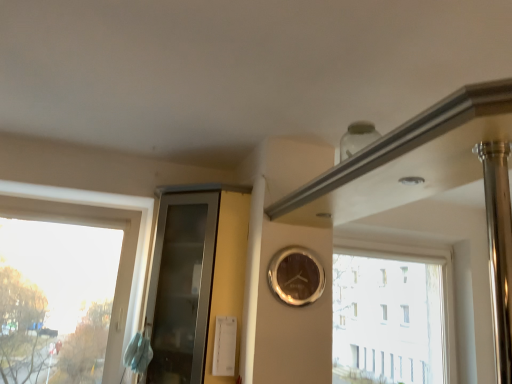
Question: In terms of size, does transparent glass window at upper right, the 1th window in the back-to-front sequence, appear bigger or smaller than shiny gold clock at center?

Choices:
 (A) small
 (B) big

Answer: (B)

Question: Is point click(x=426, y=276) positioned closer to the camera than point click(x=310, y=288)?

Choices:
 (A) closer
 (B) farther

Answer: (B)

Question: Considering the real-world distances, which object is closest to the transparent glass window at upper right, placed as the first window when sorted from right to left?

Choices:
 (A) transparent glass window at left, which ranks as the second window in right-to-left order
 (B) transparent glass cabinet at center
 (C) shiny gold clock at center

Answer: (C)

Question: Which of these objects is positioned farthest from the transparent glass window at left, acting as the 1th window starting from the front?

Choices:
 (A) shiny gold clock at center
 (B) transparent glass window at upper right, arranged as the 2th window when viewed from the front
 (C) transparent glass cabinet at center

Answer: (B)